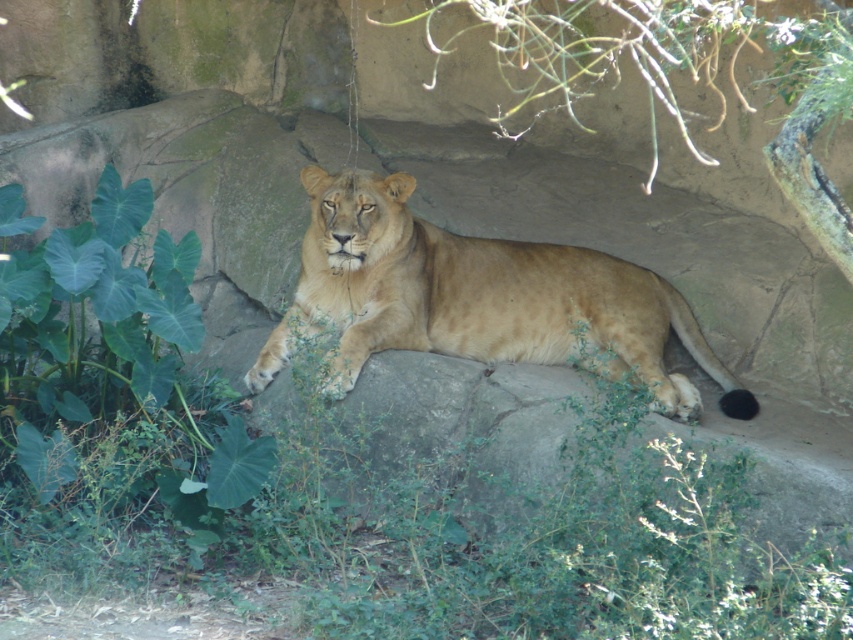
Question: Is green leafy plant at lower left below golden fur lion at center?

Choices:
 (A) yes
 (B) no

Answer: (A)

Question: In this image, where is green leafy plant at lower left located relative to golden fur lion at center?

Choices:
 (A) below
 (B) above

Answer: (A)

Question: Among these points, which one is nearest to the camera?

Choices:
 (A) (82, 460)
 (B) (467, 268)

Answer: (A)

Question: Which point appears farthest from the camera in this image?

Choices:
 (A) (479, 634)
 (B) (550, 349)

Answer: (B)

Question: Which point is farther to the camera?

Choices:
 (A) (93, 292)
 (B) (476, 276)

Answer: (B)

Question: Is green leafy plant at lower left below golden fur lion at center?

Choices:
 (A) no
 (B) yes

Answer: (B)